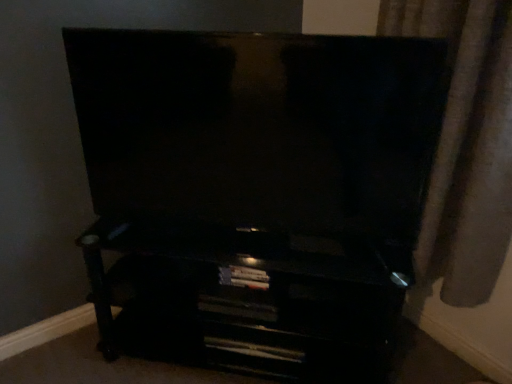
Question: Can you confirm if matte black tv at center is bigger than satin beige curtain at right?

Choices:
 (A) no
 (B) yes

Answer: (A)

Question: Is the surface of matte black tv at center in direct contact with satin beige curtain at right?

Choices:
 (A) no
 (B) yes

Answer: (A)

Question: Is matte black tv at center not inside satin beige curtain at right?

Choices:
 (A) yes
 (B) no

Answer: (A)

Question: Is the depth of matte black tv at center less than that of satin beige curtain at right?

Choices:
 (A) yes
 (B) no

Answer: (B)

Question: From the image's perspective, is matte black tv at center beneath satin beige curtain at right?

Choices:
 (A) no
 (B) yes

Answer: (A)

Question: Does matte black tv at center lie behind satin beige curtain at right?

Choices:
 (A) no
 (B) yes

Answer: (B)

Question: Can you confirm if black glossy entertainment center at lower center is positioned to the left of satin beige curtain at right?

Choices:
 (A) no
 (B) yes

Answer: (B)

Question: Is black glossy entertainment center at lower center bigger than satin beige curtain at right?

Choices:
 (A) no
 (B) yes

Answer: (B)

Question: From the image's perspective, is black glossy entertainment center at lower center over satin beige curtain at right?

Choices:
 (A) no
 (B) yes

Answer: (A)

Question: Is black glossy entertainment center at lower center beside satin beige curtain at right?

Choices:
 (A) no
 (B) yes

Answer: (A)

Question: From the image's perspective, is black glossy entertainment center at lower center under satin beige curtain at right?

Choices:
 (A) no
 (B) yes

Answer: (B)

Question: Can you confirm if black glossy entertainment center at lower center is smaller than satin beige curtain at right?

Choices:
 (A) yes
 (B) no

Answer: (B)

Question: From the image's perspective, is satin beige curtain at right under black glossy entertainment center at lower center?

Choices:
 (A) no
 (B) yes

Answer: (A)